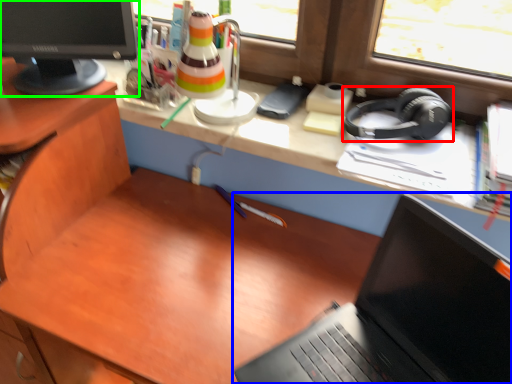
Question: Considering the real-world distances, which object is closest to headphones (highlighted by a red box)? laptop (highlighted by a blue box) or computer monitor (highlighted by a green box).

Choices:
 (A) laptop
 (B) computer monitor

Answer: (A)